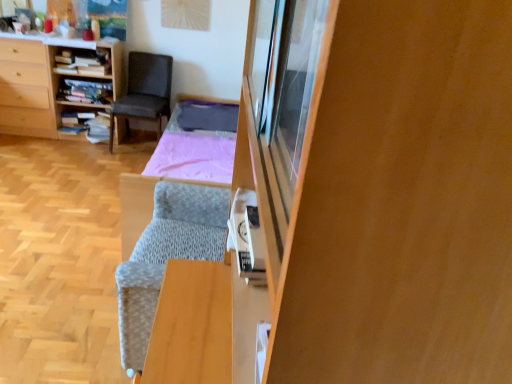
Identify the location of free space between dark gray fabric chair at upper left and wooden bookshelf at left, which appears as the third shelf when viewed from the top. This screenshot has width=512, height=384. (91, 142).